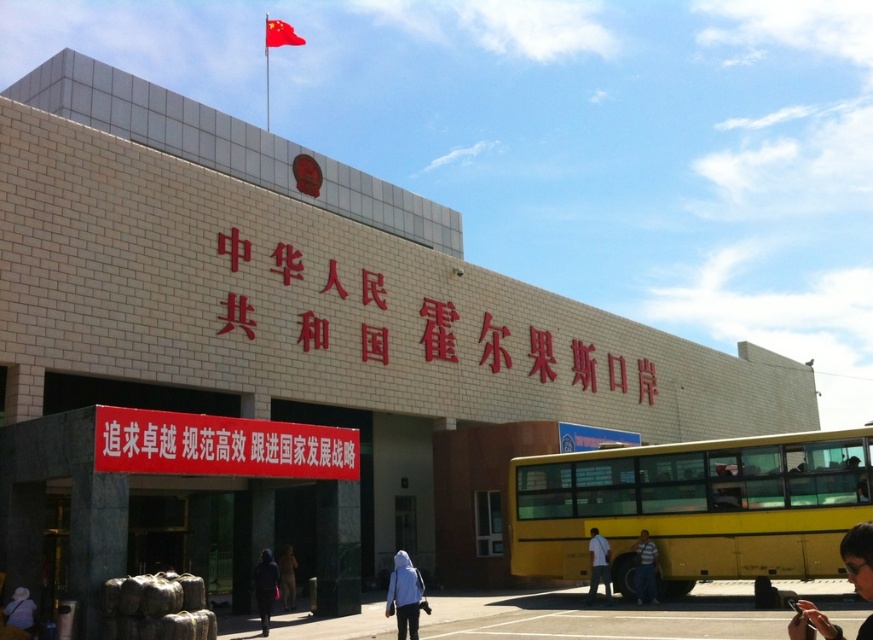
Question: Which point is farther to the camera?

Choices:
 (A) (25, 593)
 (B) (851, 576)

Answer: (A)

Question: Estimate the real-world distances between objects in this image. Which object is closer to the white matte jacket at lower center?

Choices:
 (A) red brick sign at center
 (B) dark matte jacket at lower center
 (C) dark hair at lower right

Answer: (B)

Question: Which object is the farthest from the yellow matte bus at lower right?

Choices:
 (A) dark brown leather jacket at lower center
 (B) white matte shirt at center
 (C) striped shirt at center

Answer: (A)

Question: Does yellow matte bus at lower right have a smaller size compared to dark hair at lower right?

Choices:
 (A) no
 (B) yes

Answer: (A)

Question: Does yellow matte bus at lower right have a lesser width compared to dark brown leather jacket at lower center?

Choices:
 (A) yes
 (B) no

Answer: (B)

Question: Is white matte jacket at lower center positioned before white matte shirt at center?

Choices:
 (A) no
 (B) yes

Answer: (B)